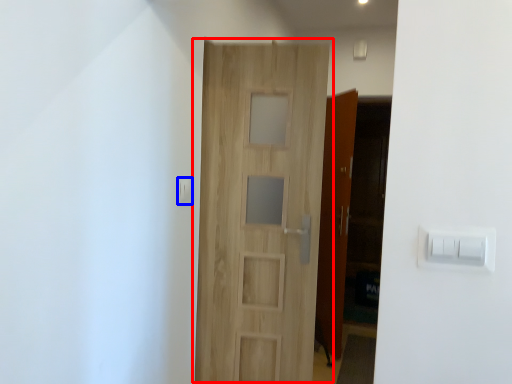
Question: Among these objects, which one is farthest to the camera, door (highlighted by a red box) or light switch (highlighted by a blue box)?

Choices:
 (A) door
 (B) light switch

Answer: (A)